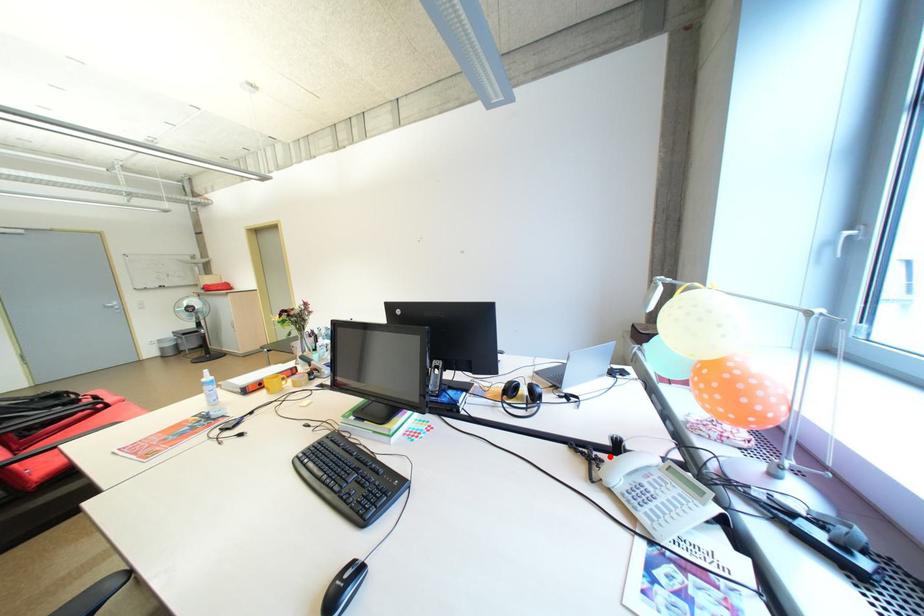
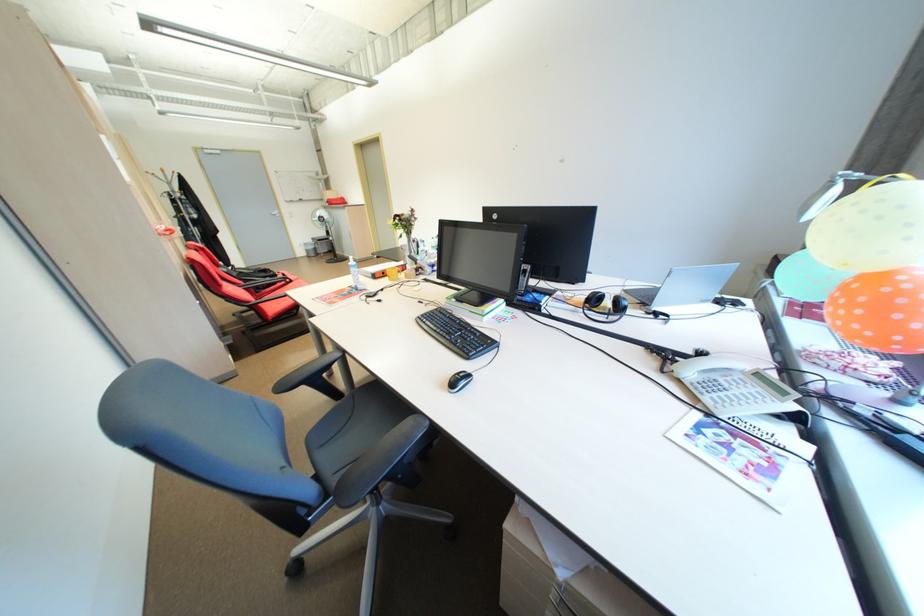
Where in the second image is the point corresponding to the highlighted location from the first image?

(687, 359)